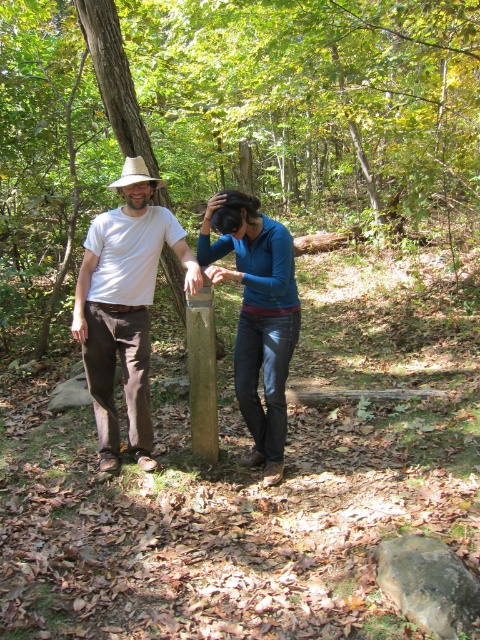
Question: Can you confirm if blue leather pants at center is thinner than white straw cowboy hat at left?

Choices:
 (A) yes
 (B) no

Answer: (B)

Question: Does smooth wooden post at center appear over blue leather pants at center?

Choices:
 (A) no
 (B) yes

Answer: (B)

Question: Considering the relative positions of white matte t-shirt at center and smooth brown wooden post at center in the image provided, where is white matte t-shirt at center located with respect to smooth brown wooden post at center?

Choices:
 (A) left
 (B) right

Answer: (A)

Question: Considering the real-world distances, which object is closest to the smooth brown wooden post at center?

Choices:
 (A) white matte t-shirt at center
 (B) smooth wooden post at center
 (C) white straw cowboy hat at left
 (D) blue leather pants at center

Answer: (D)

Question: Which point is farther to the camera?

Choices:
 (A) (468, 172)
 (B) (132, 163)
 (C) (206, 298)
 (D) (288, 364)

Answer: (A)

Question: Which object is positioned farthest from the smooth brown wooden post at center?

Choices:
 (A) white matte t-shirt at center
 (B) blue leather pants at center
 (C) smooth wooden post at center
 (D) white straw cowboy hat at left

Answer: (C)